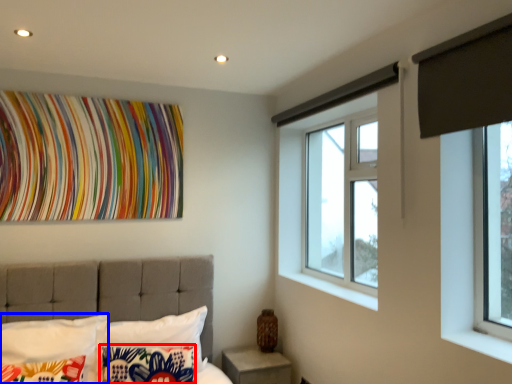
Question: Which of the following is the farthest to the observer, pillow (highlighted by a red box) or pillow (highlighted by a blue box)?

Choices:
 (A) pillow
 (B) pillow

Answer: (A)